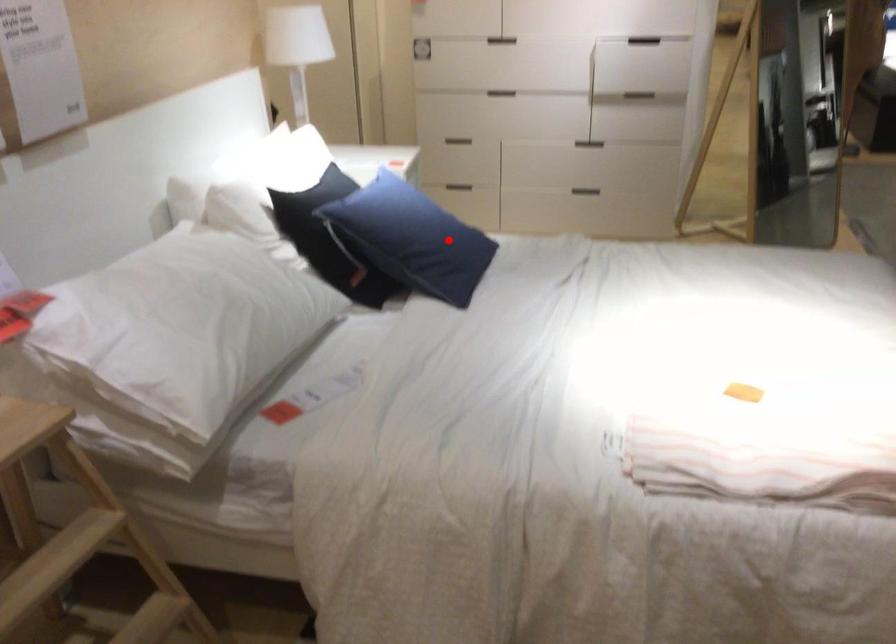
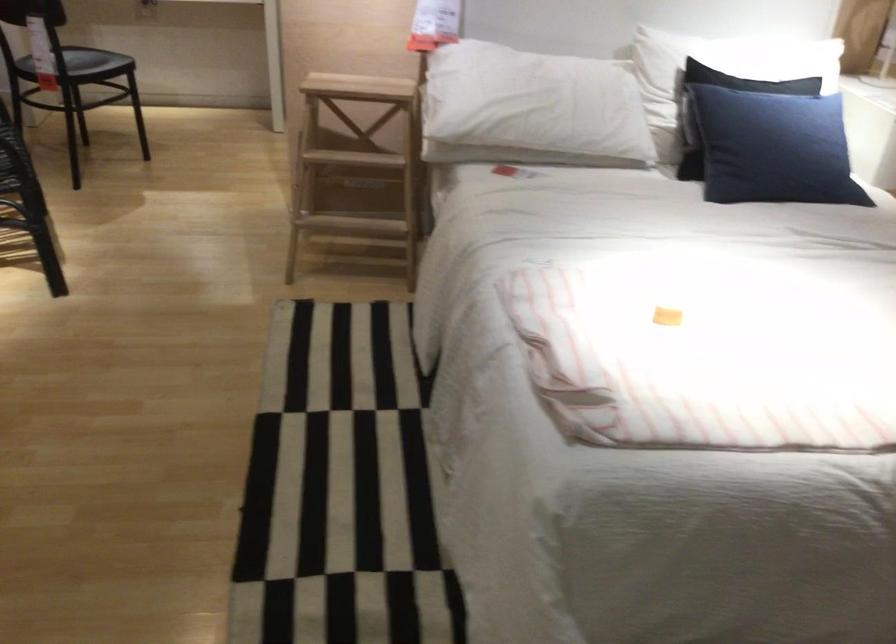
Where in the second image is the point corresponding to the highlighted location from the first image?

(773, 147)